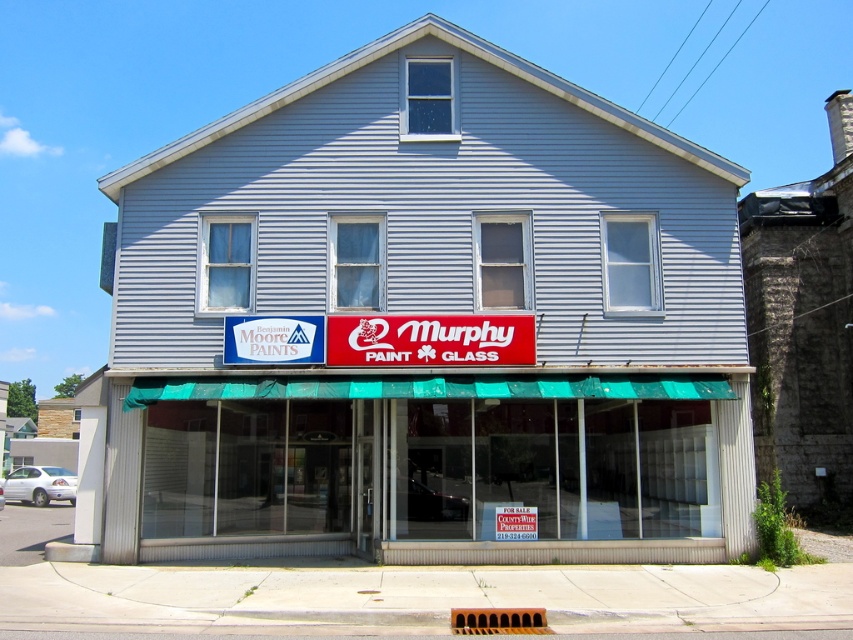
Question: Which point is closer to the camera?

Choices:
 (A) (482, 493)
 (B) (334, 262)

Answer: (A)

Question: Considering the real-world distances, which object is farthest from the green awning at center?

Choices:
 (A) red plastic sign at center
 (B) gray siding building at center

Answer: (A)

Question: Which is farther from the gray siding building at center?

Choices:
 (A) red plastic sign at center
 (B) green awning at center

Answer: (A)

Question: Does green awning at center appear on the left side of red plastic sign at center?

Choices:
 (A) no
 (B) yes

Answer: (A)

Question: Can you confirm if gray siding building at center is positioned above green awning at center?

Choices:
 (A) yes
 (B) no

Answer: (A)

Question: Considering the relative positions of gray siding building at center and red plastic sign at center in the image provided, where is gray siding building at center located with respect to red plastic sign at center?

Choices:
 (A) above
 (B) below

Answer: (A)